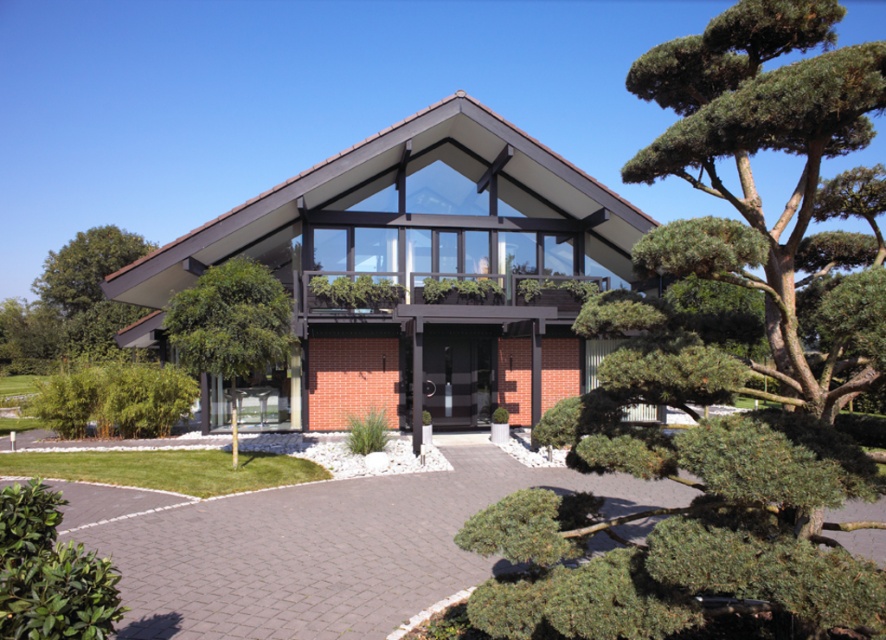
Does green textured tree at right lie behind brick paved driveway at center?

No, it is in front of brick paved driveway at center.

Which is more to the left, green textured tree at right or brick paved driveway at center?

brick paved driveway at center

Find the location of a particular element. green textured tree at right is located at coordinates (725, 355).

Which is more to the right, green textured tree at upper right or green leafy tree at center?

From the viewer's perspective, green textured tree at upper right appears more on the right side.

Find the location of a particular element. green textured tree at upper right is located at coordinates (764, 148).

At what (x,y) coordinates should I click in order to perform the action: click on green textured tree at upper right. Please return your answer as a coordinate pair (x, y). Image resolution: width=886 pixels, height=640 pixels. Looking at the image, I should click on (764, 148).

The height and width of the screenshot is (640, 886). What do you see at coordinates (725, 355) in the screenshot? I see `green textured tree at right` at bounding box center [725, 355].

Between green textured tree at right and green textured tree at upper right, which one is positioned higher?

Positioned higher is green textured tree at upper right.

Does point (585, 458) come in front of point (667, 90)?

Yes, point (585, 458) is in front of point (667, 90).

Find the location of `green textured tree at right`. green textured tree at right is located at coordinates (725, 355).